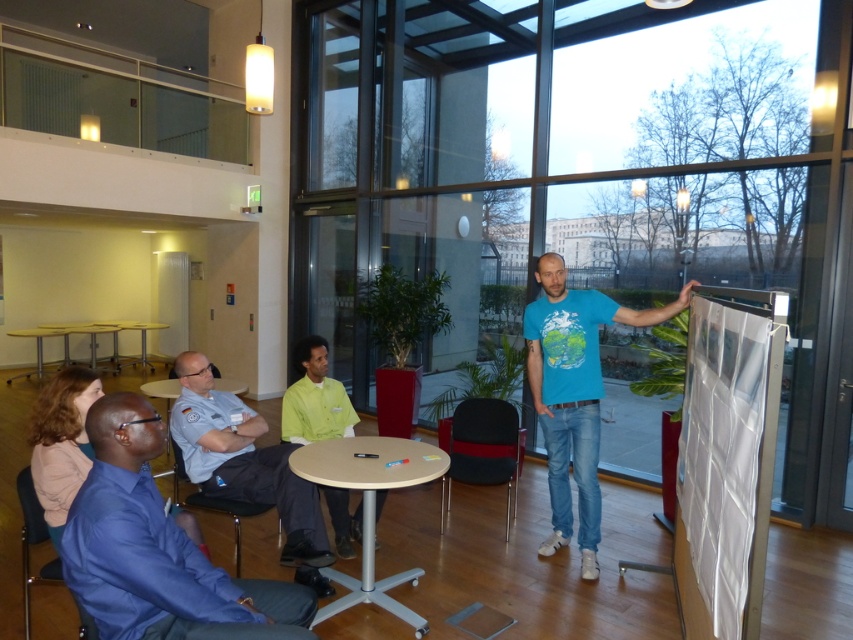
Which of these two, light green fabric shirt at center or wooden table at center, stands taller?

light green fabric shirt at center is taller.

In the scene shown: Can you confirm if light green fabric shirt at center is smaller than wooden table at center?

Yes.

Is point (318, 435) farther from camera compared to point (165, 470)?

No, (318, 435) is in front of (165, 470).

The width and height of the screenshot is (853, 640). What are the coordinates of `light green fabric shirt at center` in the screenshot? It's located at (315, 397).

Can you confirm if light blue uniform at center is positioned above light brown wooden table at center?

Yes.

The height and width of the screenshot is (640, 853). Find the location of `light blue uniform at center`. light blue uniform at center is located at coordinates (247, 467).

Is point (212, 381) more distant than point (366, 576)?

That is True.

The height and width of the screenshot is (640, 853). In order to click on light blue uniform at center in this screenshot , I will do `click(247, 467)`.

Locate an element on the screen. light blue uniform at center is located at coordinates (247, 467).

Image resolution: width=853 pixels, height=640 pixels. Identify the location of light blue uniform at center. (247, 467).

Where is `light blue uniform at center`? Image resolution: width=853 pixels, height=640 pixels. light blue uniform at center is located at coordinates tap(247, 467).